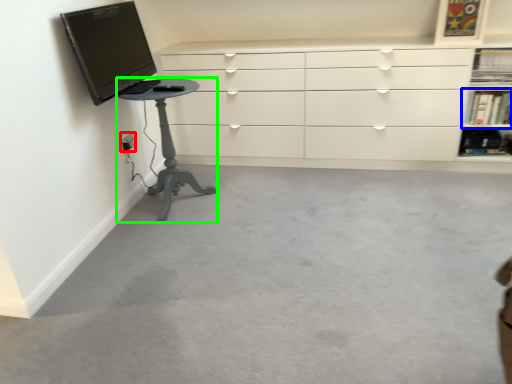
Question: Which object is the closest to the electric outlet (highlighted by a red box)? Choose among these: shelf (highlighted by a blue box) or furniture (highlighted by a green box).

Choices:
 (A) shelf
 (B) furniture

Answer: (B)